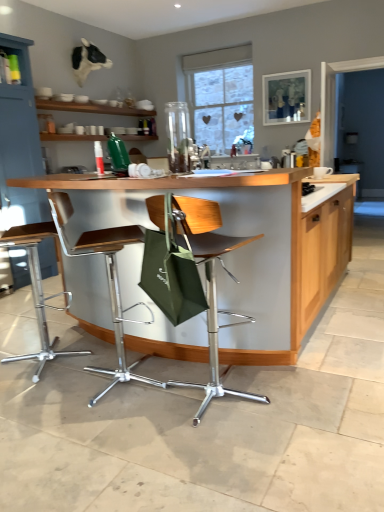
Identify the location of unoccupied region to the right of brown leather chair at center, acting as the 3th chair starting from the left. Image resolution: width=384 pixels, height=512 pixels. (300, 396).